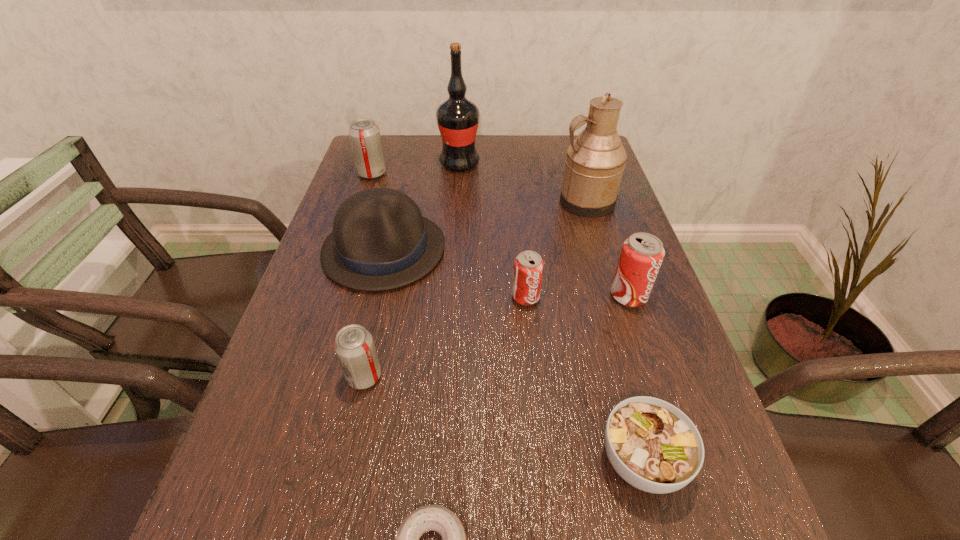
You are a GUI agent. You are given a task and a screenshot of the screen. Output one action in this format:
    pyautogui.click(x=<x>, y=<y>)
    Task: Click on the free spot that satisfies the following two spatial constraints: 1. on the front-facing side of the white soup bowl; 2. on the right side of the bowler hat
    The height and width of the screenshot is (540, 960).
    Given the screenshot: What is the action you would take?
    [333, 461]

Identify the location of free spot that satisfies the following two spatial constraints: 1. on the front-facing side of the bigger pink soda can; 2. on the right side of the bowler hat. (372, 296).